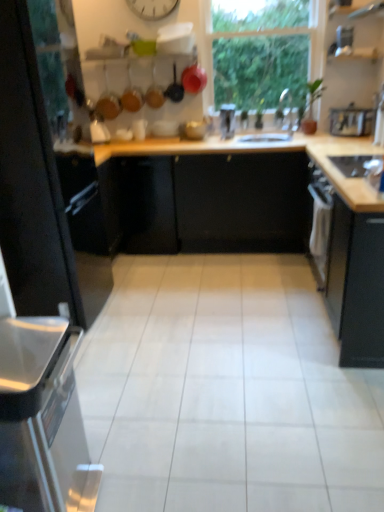
This screenshot has height=512, width=384. What do you see at coordinates (43, 419) in the screenshot?
I see `satin silver dishwasher at left` at bounding box center [43, 419].

Describe the element at coordinates (227, 121) in the screenshot. I see `metallic silver toaster at center, arranged as the fourth appliance when viewed from the front` at that location.

The image size is (384, 512). Identify the location of metallic silver toaster at center, arranged as the fourth appliance when viewed from the front. (227, 121).

Measure the distance between white glossy sink at center and camera.

white glossy sink at center and camera are 3.61 meters apart.

This screenshot has width=384, height=512. What do you see at coordinates (131, 96) in the screenshot? I see `matte black frying pan at upper center, the first frying pan positioned from the left` at bounding box center [131, 96].

Identify the location of white plastic clock at upper center. The height and width of the screenshot is (512, 384). (152, 8).

Which is closer, (51, 218) or (153, 97)?

Point (51, 218) is positioned closer to the camera compared to point (153, 97).

Can you confirm if black matte cabinet at left, the second cabinetry in the right-to-left sequence, is positioned to the right of matte black frying pan at upper center, which appears as the second frying pan when viewed from the right?

Incorrect, black matte cabinet at left, the second cabinetry in the right-to-left sequence, is not on the right side of matte black frying pan at upper center, which appears as the second frying pan when viewed from the right.

Is black matte cabinet at left, which ranks as the 1th cabinetry in left-to-right order, facing towards matte black frying pan at upper center, which appears as the second frying pan when viewed from the right?

No, black matte cabinet at left, which ranks as the 1th cabinetry in left-to-right order, is not oriented towards matte black frying pan at upper center, which appears as the second frying pan when viewed from the right.

Is metallic silver kettle at upper right, which appears as the 3th appliance when viewed from the top, inside the boundaries of black matte cabinet at left, which ranks as the 1th cabinetry in left-to-right order, or outside?

The correct answer is: outside.

Is point (354, 114) positioned behind point (2, 170)?

Yes, point (354, 114) is behind point (2, 170).

Is metallic silver kettle at upper right, which is counted as the fifth appliance, starting from the left, touching black matte cabinet at left, which ranks as the 1th cabinetry in left-to-right order?

metallic silver kettle at upper right, which is counted as the fifth appliance, starting from the left, and black matte cabinet at left, which ranks as the 1th cabinetry in left-to-right order, are not in contact.

Considering the relative sizes of metallic silver kettle at upper right, the 1th appliance from the right, and black matte cabinet at left, which ranks as the 1th cabinetry in left-to-right order, in the image provided, is metallic silver kettle at upper right, the 1th appliance from the right, bigger than black matte cabinet at left, which ranks as the 1th cabinetry in left-to-right order,?

Actually, metallic silver kettle at upper right, the 1th appliance from the right, might be smaller than black matte cabinet at left, which ranks as the 1th cabinetry in left-to-right order.

Is black glass stove at right, the fifth appliance positioned from the back, looking in the opposite direction of metallic silver toaster at upper right, arranged as the second appliance when viewed from the front?

No, black glass stove at right, the fifth appliance positioned from the back, is not facing the opposite direction of metallic silver toaster at upper right, arranged as the second appliance when viewed from the front.

Which is more to the left, black glass stove at right, positioned as the 1th appliance in front-to-back order, or metallic silver toaster at upper right, acting as the 4th appliance starting from the left?

black glass stove at right, positioned as the 1th appliance in front-to-back order, is more to the left.

Does black glass stove at right, positioned as the 1th appliance in front-to-back order, have a greater height compared to metallic silver toaster at upper right, the 1th appliance positioned from the top?

In fact, black glass stove at right, positioned as the 1th appliance in front-to-back order, may be shorter than metallic silver toaster at upper right, the 1th appliance positioned from the top.

Is black glass stove at right, which is the 1th appliance in bottom-to-top order, smaller than metallic silver toaster at upper right, which is the 5th appliance in bottom-to-top order?

No, black glass stove at right, which is the 1th appliance in bottom-to-top order, is not smaller than metallic silver toaster at upper right, which is the 5th appliance in bottom-to-top order.

Is metallic silver toaster at upper right, the 2th appliance from the right, oriented towards black matte cabinet at left, the second cabinetry in the right-to-left sequence?

No, metallic silver toaster at upper right, the 2th appliance from the right, does not turn towards black matte cabinet at left, the second cabinetry in the right-to-left sequence.

Is black matte cabinet at left, which ranks as the 1th cabinetry in left-to-right order, a part of metallic silver toaster at upper right, arranged as the second appliance when viewed from the front?

Actually, black matte cabinet at left, which ranks as the 1th cabinetry in left-to-right order, is outside metallic silver toaster at upper right, arranged as the second appliance when viewed from the front.

Is metallic silver toaster at upper right, acting as the 4th appliance starting from the left, bigger or smaller than black matte cabinet at left, the second cabinetry in the right-to-left sequence?

metallic silver toaster at upper right, acting as the 4th appliance starting from the left, is smaller than black matte cabinet at left, the second cabinetry in the right-to-left sequence.

Is point (342, 26) positioned before point (22, 237)?

No, (342, 26) is behind (22, 237).

Is matte black frying pan at upper center, the first frying pan positioned from the left, at the back of metallic silver kettle at upper right, which appears as the 3th appliance when viewed from the top?

metallic silver kettle at upper right, which appears as the 3th appliance when viewed from the top, does not have its back to matte black frying pan at upper center, the first frying pan positioned from the left.

Consider the image. Is metallic silver kettle at upper right, marked as the 3th appliance in a bottom-to-top arrangement, smaller than matte black frying pan at upper center, acting as the 3th frying pan starting from the right?

No.

Does metallic silver kettle at upper right, marked as the 3th appliance in a bottom-to-top arrangement, have a lesser width compared to matte black frying pan at upper center, acting as the 3th frying pan starting from the right?

No, metallic silver kettle at upper right, marked as the 3th appliance in a bottom-to-top arrangement, is not thinner than matte black frying pan at upper center, acting as the 3th frying pan starting from the right.

Between metallic silver kettle at upper right, marked as the 3th appliance in a bottom-to-top arrangement, and matte black frying pan at upper center, acting as the 3th frying pan starting from the right, which one appears on the right side from the viewer's perspective?

metallic silver kettle at upper right, marked as the 3th appliance in a bottom-to-top arrangement.

You are a GUI agent. You are given a task and a screenshot of the screen. Output one action in this format:
    pyautogui.click(x=<x>, y=<y>)
    Task: Click on the clock on the left of transparent glass window at upper center
    
    Given the screenshot: What is the action you would take?
    pyautogui.click(x=152, y=8)

Can you tell me how much white plastic clock at upper center and transparent glass window at upper center differ in facing direction?

There is a 0.398-degree angle between the facing directions of white plastic clock at upper center and transparent glass window at upper center.

Considering the sizes of objects white plastic clock at upper center and transparent glass window at upper center in the image provided, who is smaller, white plastic clock at upper center or transparent glass window at upper center?

white plastic clock at upper center is smaller.

Does white plastic clock at upper center touch transparent glass window at upper center?

No, white plastic clock at upper center is not touching transparent glass window at upper center.

Consider the image. How different are the orientations of metallic silver toaster at upper right, the 2th appliance from the right, and white glossy kettle at upper left, the 2th appliance when ordered from bottom to top, in degrees?

173 degrees.

Which object is thinner, metallic silver toaster at upper right, arranged as the second appliance when viewed from the front, or white glossy kettle at upper left, acting as the fourth appliance starting from the top?

white glossy kettle at upper left, acting as the fourth appliance starting from the top.

Looking at this image, who is more distant, metallic silver toaster at upper right, acting as the 4th appliance starting from the left, or white glossy kettle at upper left, the fifth appliance from the right?

white glossy kettle at upper left, the fifth appliance from the right, is more distant.

Is metallic silver toaster at upper right, acting as the 4th appliance starting from the left, turned away from white glossy kettle at upper left, which is the 1th appliance in left-to-right order?

metallic silver toaster at upper right, acting as the 4th appliance starting from the left, is not turned away from white glossy kettle at upper left, which is the 1th appliance in left-to-right order.

There is a matte black frying pan at upper center, arranged as the 2th frying pan when viewed from the left. At what (x,y) coordinates should I click in order to perform the action: click on the 1st cabinetry below it (from a real-world perspective). Please return your answer as a coordinate pair (x, y). The image size is (384, 512). Looking at the image, I should click on pyautogui.click(x=37, y=192).

The image size is (384, 512). There is a metallic silver kettle at upper right, the 3th appliance from the back. Identify the location of the 1st cabinetry below it (from the image's perspective). (37, 192).

Which object lies further to the anchor point black matte cabinet at right, the first cabinetry from the right, white glossy sink at center or matte black frying pan at upper center, acting as the 3th frying pan starting from the right?

matte black frying pan at upper center, acting as the 3th frying pan starting from the right, is further to black matte cabinet at right, the first cabinetry from the right.

In the scene shown: Which object lies nearer to the anchor point satin silver dishwasher at left, black glass stove at right, positioned as the 1th appliance in front-to-back order, or white plastic clock at upper center?

The object closer to satin silver dishwasher at left is black glass stove at right, positioned as the 1th appliance in front-to-back order.

Based on their spatial positions, is white glossy kettle at upper left, the fifth appliance from the right, or matte black frying pan at upper center, the third frying pan from the left, further from metallic silver toaster at upper right, which is the 5th appliance in bottom-to-top order?

Based on the image, white glossy kettle at upper left, the fifth appliance from the right, appears to be further to metallic silver toaster at upper right, which is the 5th appliance in bottom-to-top order.

Estimate the real-world distances between objects in this image. Which object is closer to white glossy kettle at upper left, which is the 1th appliance in left-to-right order, metallic silver kettle at upper right, which is counted as the fifth appliance, starting from the left, or black matte cabinet at left, which ranks as the 1th cabinetry in left-to-right order?

black matte cabinet at left, which ranks as the 1th cabinetry in left-to-right order, is closer to white glossy kettle at upper left, which is the 1th appliance in left-to-right order.

Looking at the image, which one is located closer to black glass stove at right, the fifth appliance positioned from the back, metallic silver kettle at upper right, the 1th appliance from the right, or white glossy kettle at upper left, the 2th appliance when ordered from bottom to top?

metallic silver kettle at upper right, the 1th appliance from the right, is closer to black glass stove at right, the fifth appliance positioned from the back.

When comparing their distances from matte black frying pan at upper center, the first frying pan positioned from the left, does satin silver dishwasher at left or metallic silver toaster at center, the second appliance viewed from the back, seem further?

satin silver dishwasher at left is positioned further to the anchor matte black frying pan at upper center, the first frying pan positioned from the left.

Which object lies nearer to the anchor point black matte cabinet at right, which is the 2th cabinetry in left-to-right order, metallic silver kettle at upper right, which is counted as the fifth appliance, starting from the left, or matte black frying pan at upper center, which appears as the second frying pan when viewed from the right?

metallic silver kettle at upper right, which is counted as the fifth appliance, starting from the left, is closer to black matte cabinet at right, which is the 2th cabinetry in left-to-right order.

Estimate the real-world distances between objects in this image. Which object is further from metallic silver toaster at center, which ranks as the 4th appliance in bottom-to-top order, black glass stove at right, which is the 3th appliance in right-to-left order, or metallic silver toaster at upper right, arranged as the second appliance when viewed from the front?

Based on the image, black glass stove at right, which is the 3th appliance in right-to-left order, appears to be further to metallic silver toaster at center, which ranks as the 4th appliance in bottom-to-top order.

Where is `appliance situated between matte black frying pan at upper center, the third frying pan from the left, and white glossy sink at center from left to right`? The width and height of the screenshot is (384, 512). appliance situated between matte black frying pan at upper center, the third frying pan from the left, and white glossy sink at center from left to right is located at coordinates (227, 121).

I want to click on sink between black matte cabinet at left, the second cabinetry in the right-to-left sequence, and white plastic clock at upper center from front to back, so click(274, 122).

What are the coordinates of `sink between white plastic clock at upper center and black matte cabinet at right, the first cabinetry from the right, from top to bottom` in the screenshot? It's located at (274, 122).

Locate an element on the screen. clock between black matte cabinet at right, the first cabinetry from the right, and metallic silver toaster at center, which is the second appliance in top-to-bottom order, from front to back is located at coordinates (152, 8).